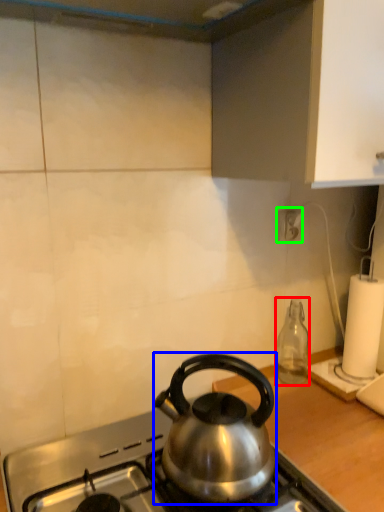
Question: Which object is positioned closest to bottle (highlighted by a red box)? Select from kettle (highlighted by a blue box) and power outlet (highlighted by a green box).

Choices:
 (A) kettle
 (B) power outlet

Answer: (B)